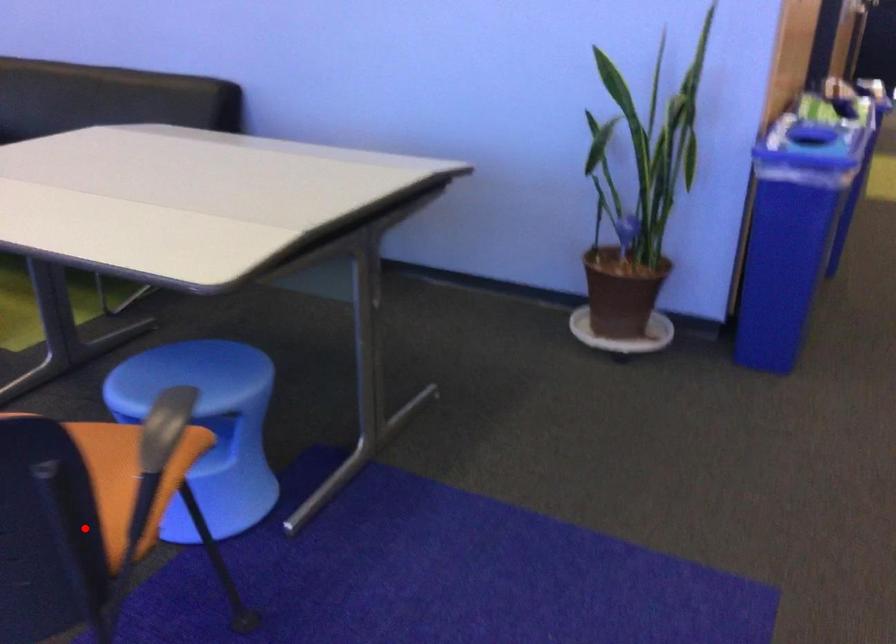
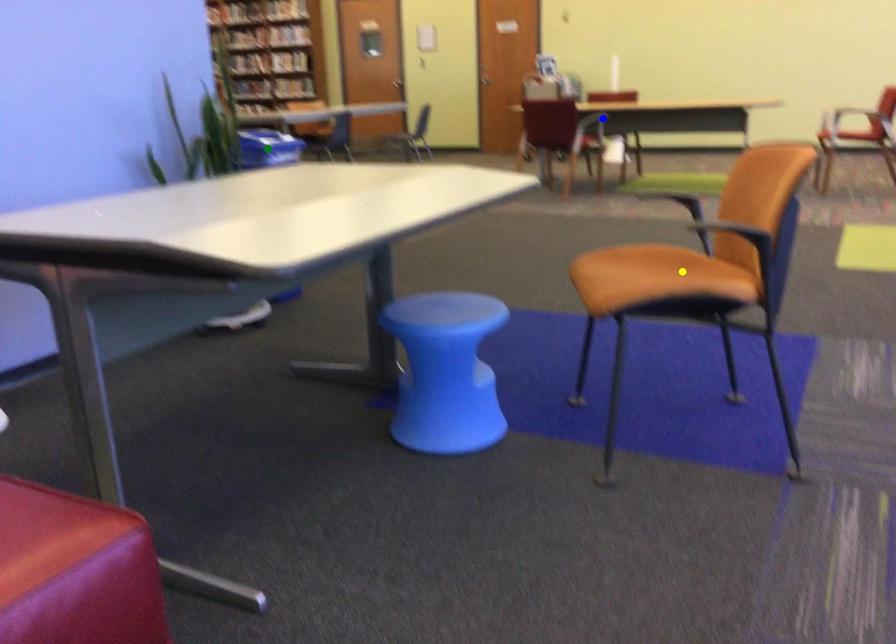
Question: I am providing you with two images of the same scene from different viewpoints. A red point is marked on the first image. You are given multiple points on the second image. Which spot in image 2 lines up with the point in image 1?

Choices:
 (A) yellow point
 (B) blue point
 (C) green point

Answer: (A)